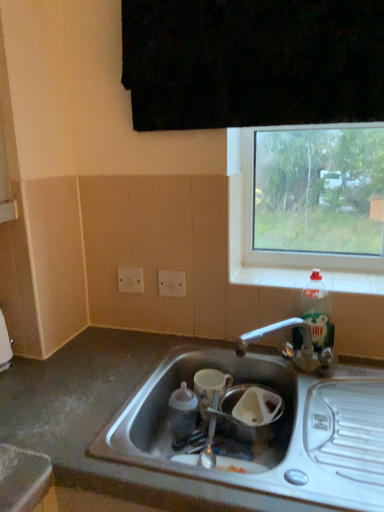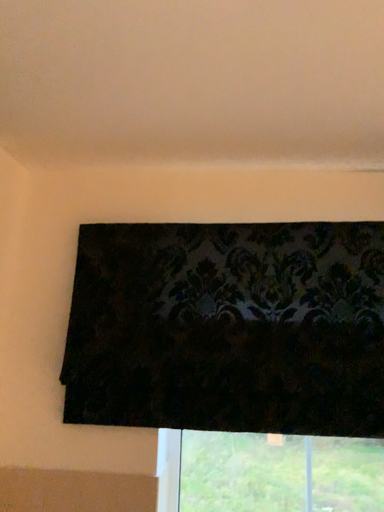
Question: Which way did the camera rotate in the video?

Choices:
 (A) rotated left
 (B) rotated right

Answer: (B)